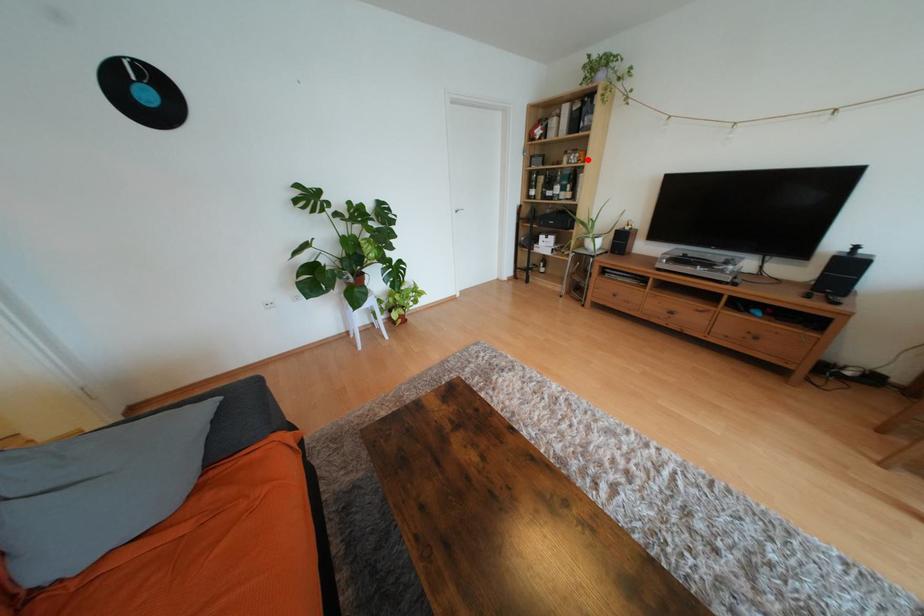
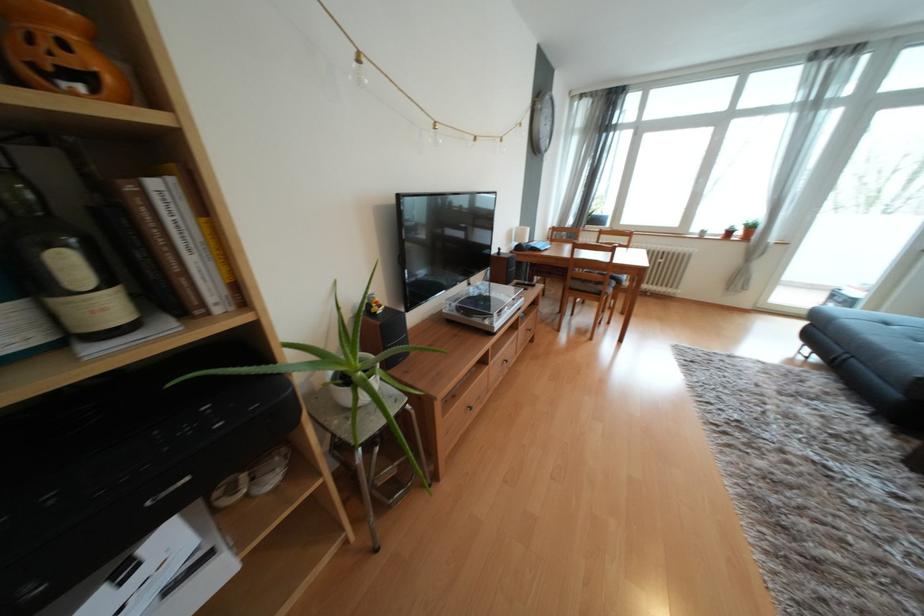
Locate, in the second image, the point that corresponds to the highlighted location in the first image.

(104, 68)